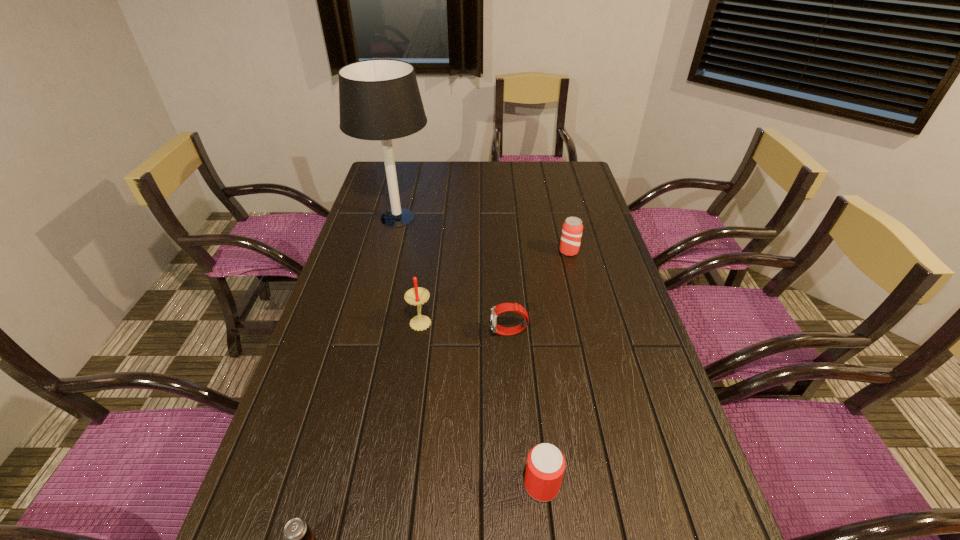
Locate an element on the screen. the tallest object is located at coordinates (379, 99).

At what (x,y) coordinates should I click in order to perform the action: click on table lamp. Please return your answer as a coordinate pair (x, y). Looking at the image, I should click on (379, 99).

At what (x,y) coordinates should I click in order to perform the action: click on candle. Please return your answer as a coordinate pair (x, y). The height and width of the screenshot is (540, 960). Looking at the image, I should click on click(416, 296).

You are a GUI agent. You are given a task and a screenshot of the screen. Output one action in this format:
    pyautogui.click(x=<x>, y=<y>)
    Task: Click on the farthest beer can
    The width and height of the screenshot is (960, 540).
    Given the screenshot: What is the action you would take?
    pyautogui.click(x=572, y=228)

Find the location of `the rightmost object`. the rightmost object is located at coordinates (572, 228).

Find the location of a particular element. Image resolution: width=960 pixels, height=540 pixels. the second nearest object is located at coordinates (545, 467).

Image resolution: width=960 pixels, height=540 pixels. Identify the location of the second nearest beer can. (545, 467).

Where is `watch`? watch is located at coordinates (504, 307).

Find the location of a particular element. vacant position located 0.090m on the right of the farthest object is located at coordinates (459, 218).

Identify the location of free location located 0.330m on the back of the candle. (432, 242).